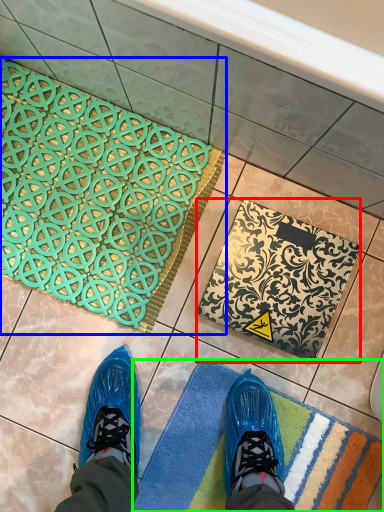
Question: Which object is positioned farthest from bath mat (highlighted by a red box)? Select from bath mat (highlighted by a blue box) and bath mat (highlighted by a green box).

Choices:
 (A) bath mat
 (B) bath mat

Answer: (A)